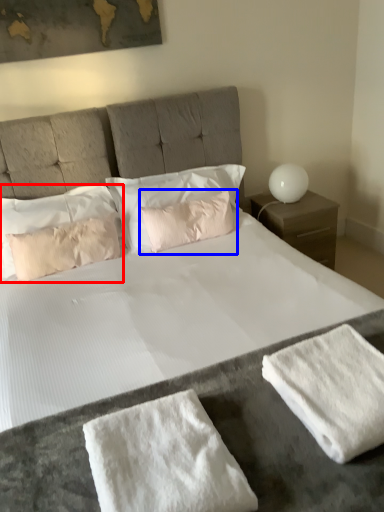
Question: Which object is closer to the camera taking this photo, pillow (highlighted by a red box) or pillow (highlighted by a blue box)?

Choices:
 (A) pillow
 (B) pillow

Answer: (A)